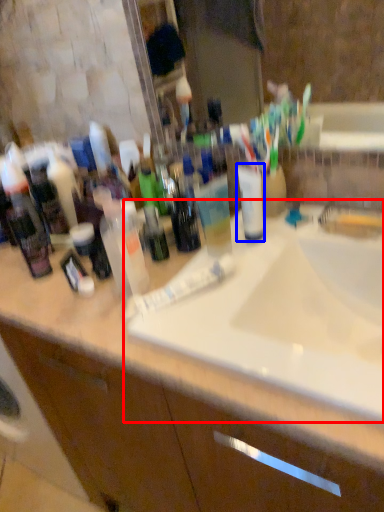
Question: Which object appears closest to the camera in this image, sink (highlighted by a red box) or mouthwash (highlighted by a blue box)?

Choices:
 (A) sink
 (B) mouthwash

Answer: (A)